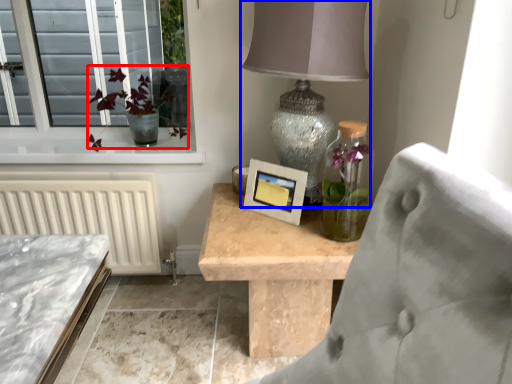
Question: Which object appears farthest to the camera in this image, floral arrangement (highlighted by a red box) or table lamp (highlighted by a blue box)?

Choices:
 (A) floral arrangement
 (B) table lamp

Answer: (A)